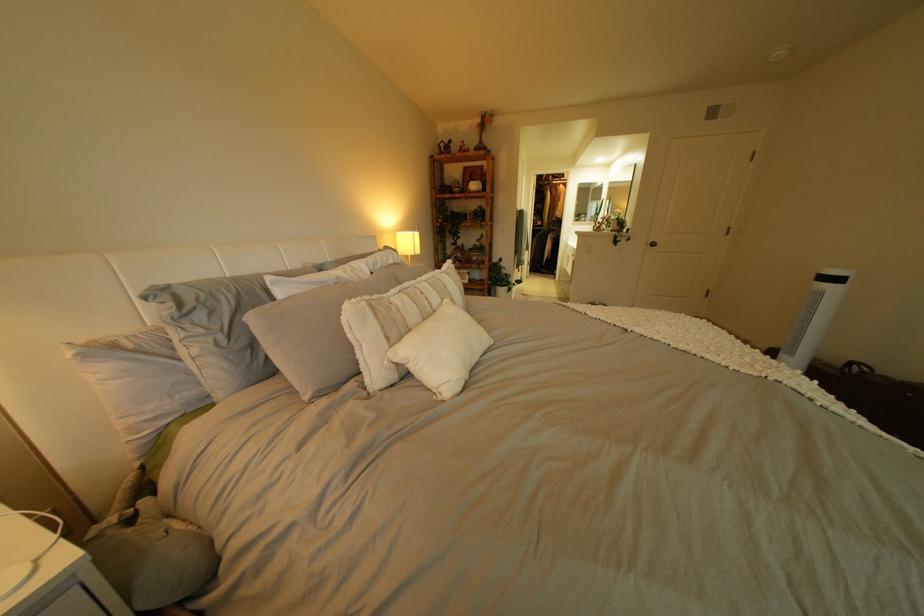
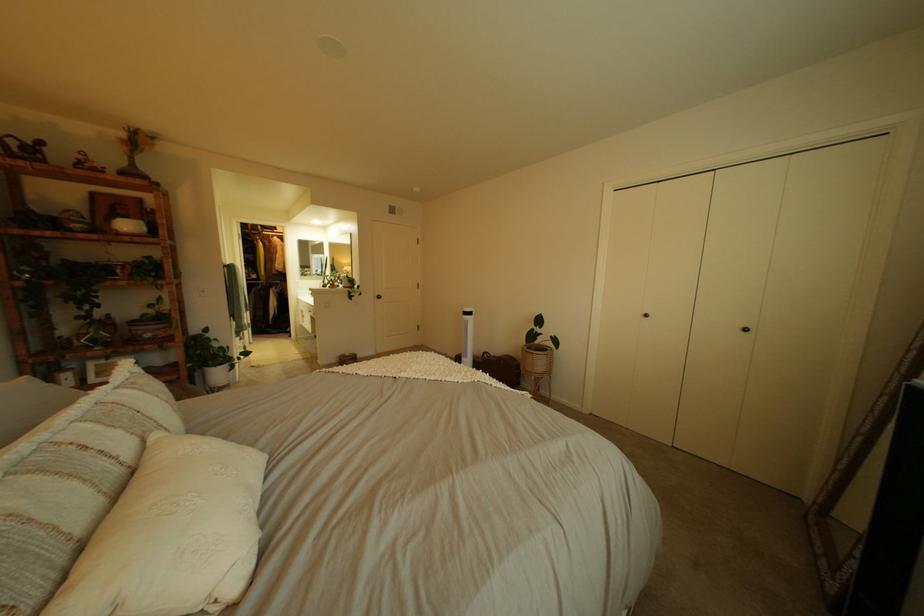
Locate, in the second image, the point that corresponds to the point at 485,191 in the first image.

(132, 232)